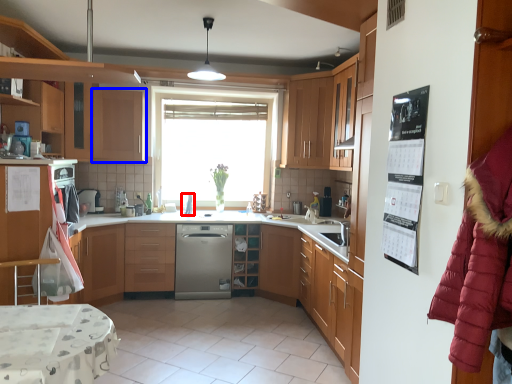
Question: Which object appears farthest to the camera in this image, appliance (highlighted by a red box) or cabinetry (highlighted by a blue box)?

Choices:
 (A) appliance
 (B) cabinetry

Answer: (A)